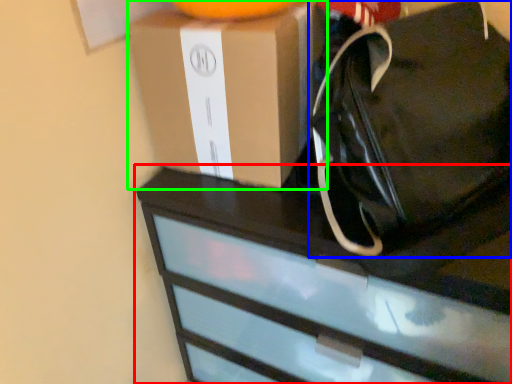
Question: Which object is positioned closest to chest of drawers (highlighted by a red box)? Select from tote bag (highlighted by a blue box) and box (highlighted by a green box).

Choices:
 (A) tote bag
 (B) box

Answer: (A)